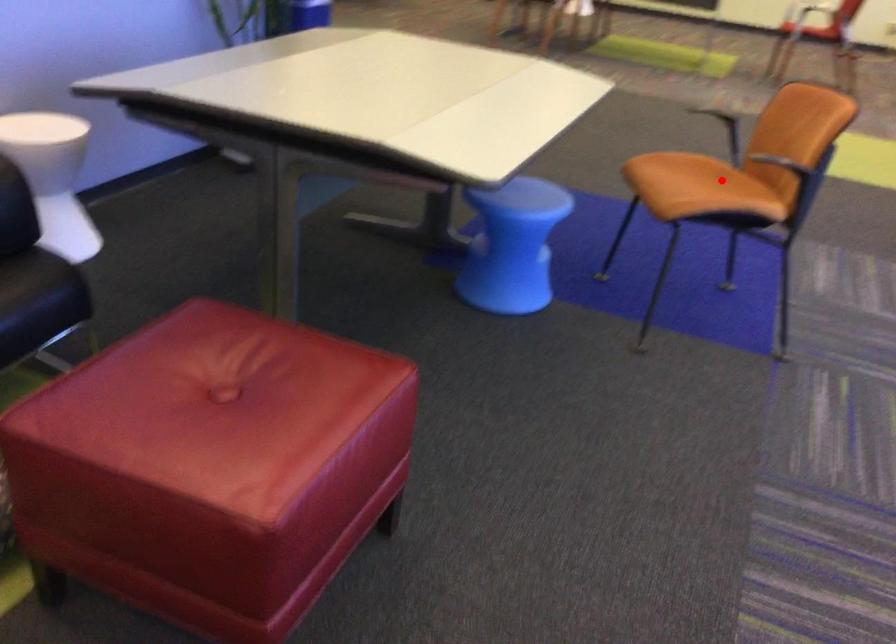
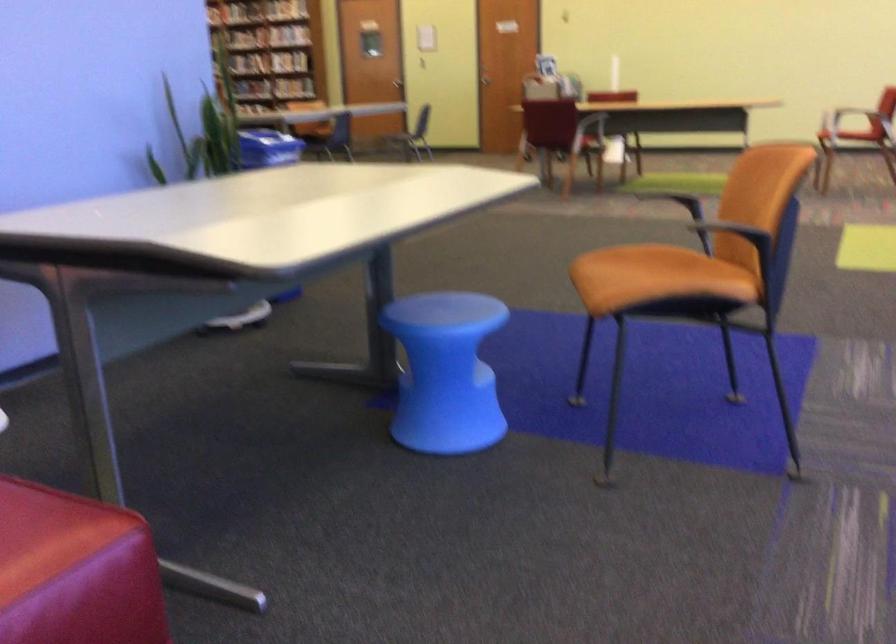
Question: I am providing you with two images of the same scene from different viewpoints. A red point is shown in image1. For the corresponding object point in image2, is it positioned nearer or farther from the camera?

Choices:
 (A) Nearer
 (B) Farther

Answer: (A)